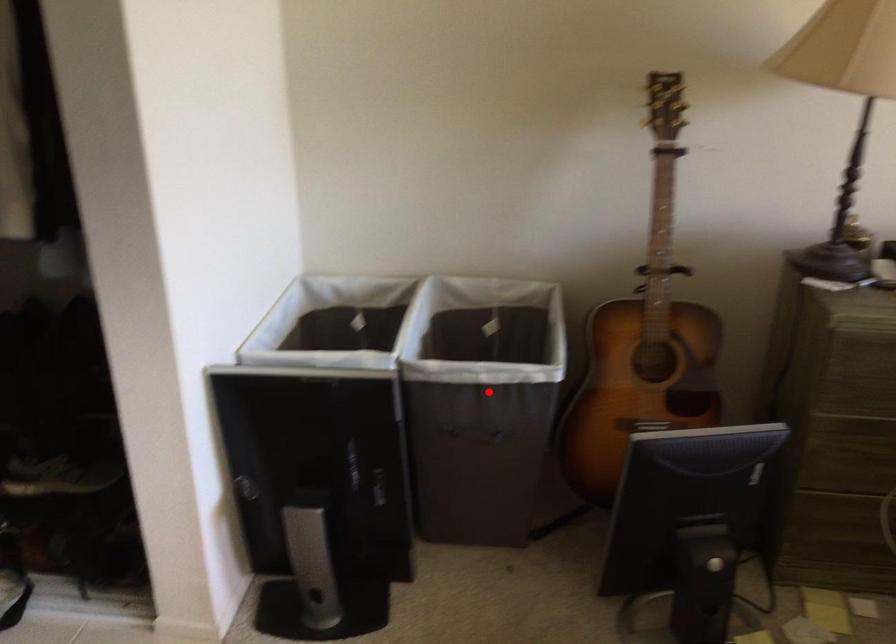
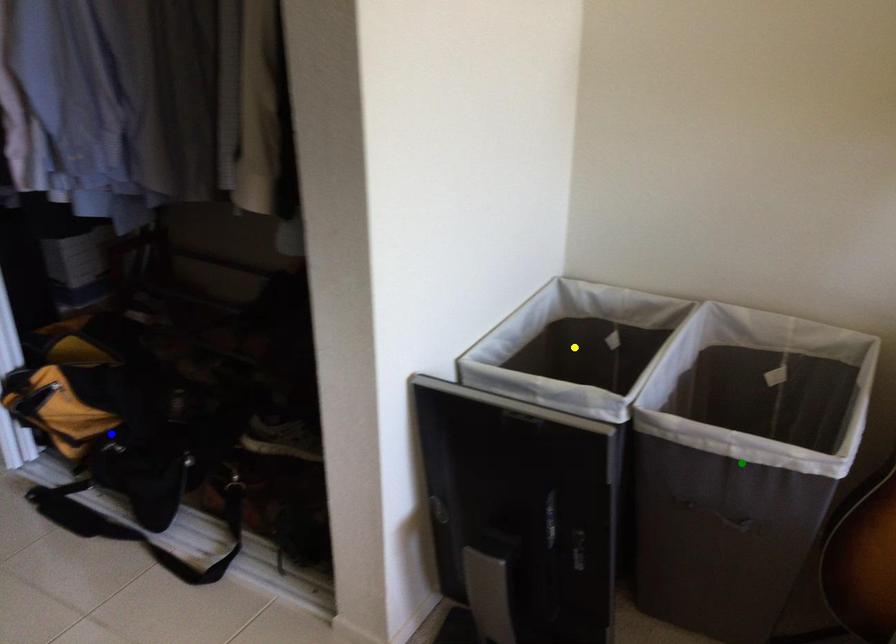
Question: I am providing you with two images of the same scene from different viewpoints. A red point is marked on the first image. You are given multiple points on the second image. Can you choose the point in image 2 that corresponds to the point in image 1?

Choices:
 (A) green point
 (B) yellow point
 (C) blue point

Answer: (A)